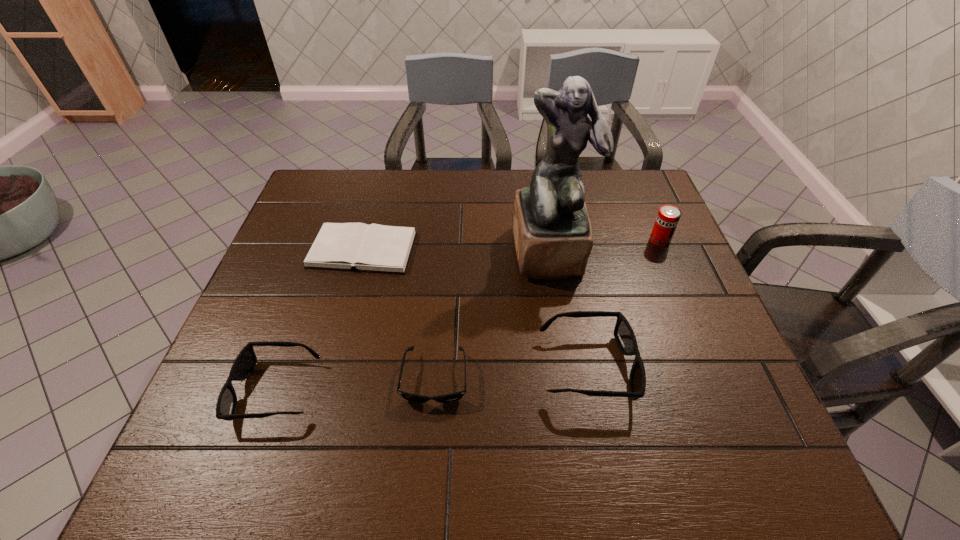
Locate an element on the screen. The height and width of the screenshot is (540, 960). blank area located 0.080m on the front-facing side of the rightmost sunglasses is located at coordinates (670, 367).

This screenshot has height=540, width=960. What are the coordinates of `vacant space located 0.220m in a relaxed pose on the sculpture` in the screenshot? It's located at (566, 353).

The height and width of the screenshot is (540, 960). In order to click on vacant region located on the right of the shortest object in this screenshot , I will do `click(432, 250)`.

Find the location of `vacant space located on the front of the can`. vacant space located on the front of the can is located at coordinates (706, 347).

This screenshot has height=540, width=960. I want to click on sunglasses present at the left edge, so click(x=245, y=362).

Image resolution: width=960 pixels, height=540 pixels. I want to click on hardback book located at the left edge, so coord(376,248).

At what (x,y) coordinates should I click in order to perform the action: click on object present at the right edge. Please return your answer as a coordinate pair (x, y). Looking at the image, I should click on (668, 216).

Locate an element on the screen. Image resolution: width=960 pixels, height=540 pixels. object positioned at the near left corner is located at coordinates (245, 362).

Locate an element on the screen. The height and width of the screenshot is (540, 960). vacant area at the far edge of the desktop is located at coordinates (360, 191).

What are the coordinates of `free spot at the near edge of the desktop` in the screenshot? It's located at (341, 392).